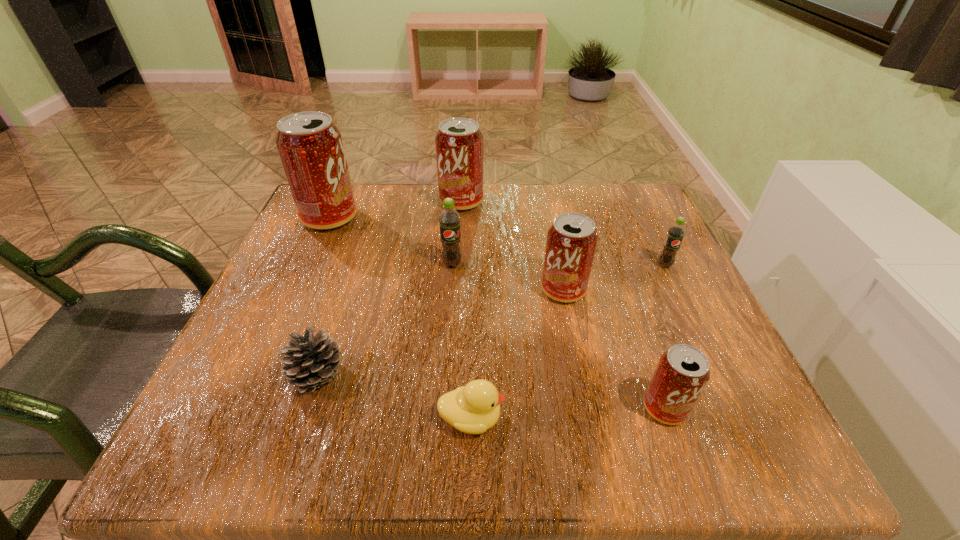
I want to click on the second soda can from right to left, so click(x=682, y=372).

Identify the location of pinecone. Image resolution: width=960 pixels, height=540 pixels. (313, 361).

Image resolution: width=960 pixels, height=540 pixels. Identify the location of duckling. (473, 409).

Locate an element on the screen. yellow duckling is located at coordinates (473, 409).

The height and width of the screenshot is (540, 960). What are the coordinates of `vacant space located 0.130m on the front of the tallest soda can` in the screenshot? It's located at pos(305,273).

Locate an element on the screen. This screenshot has height=540, width=960. vacant space located 0.050m on the right of the seventh shortest object is located at coordinates (504, 202).

I want to click on vacant space located on the left of the third biggest red soda can, so click(427, 290).

Where is `blank space located on the front label of the left green soda`? The width and height of the screenshot is (960, 540). blank space located on the front label of the left green soda is located at coordinates (449, 306).

At what (x,y) coordinates should I click in order to perform the action: click on free space located 0.280m on the front label of the smaller green soda. Please return your answer as a coordinate pair (x, y). The width and height of the screenshot is (960, 540). Looking at the image, I should click on (724, 388).

I want to click on vacant point located 0.260m on the back of the second object from right to left, so click(x=619, y=278).